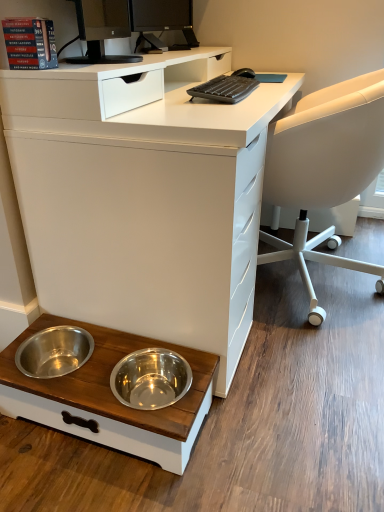
You are a GUI agent. You are given a task and a screenshot of the screen. Output one action in this format:
    pyautogui.click(x=<x>, y=<y>)
    Task: Click on the empty space that is to the right of wooden pet bowls at lower left
    
    Given the screenshot: What is the action you would take?
    pyautogui.click(x=274, y=413)